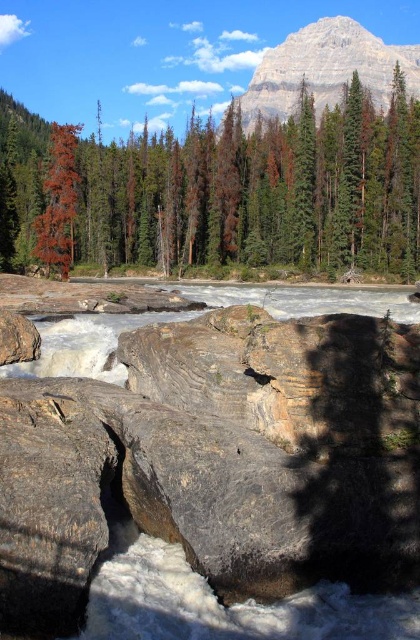
Is rocky beige mountain at upper center taller than reddish-brown bark tree at left?

Yes.

Locate an element on the screen. rocky beige mountain at upper center is located at coordinates (325, 68).

Is point (382, 48) positioned in front of point (62, 152)?

No, it is not.

Where is `rocky beige mountain at upper center`? The height and width of the screenshot is (640, 420). rocky beige mountain at upper center is located at coordinates (x=325, y=68).

Which is behind, point (335, 177) or point (296, 86)?

The point (296, 86) is behind.

Which is below, dead wood trees at upper left or rocky beige mountain at upper center?

Positioned lower is dead wood trees at upper left.

Which is in front, point (288, 164) or point (278, 52)?

Positioned in front is point (288, 164).

Locate an element on the screen. The image size is (420, 640). dead wood trees at upper left is located at coordinates (259, 192).

Measure the distance between dead wood trees at upper left and reddish-brown bark tree at left.

A distance of 120.56 feet exists between dead wood trees at upper left and reddish-brown bark tree at left.

Locate an element on the screen. The height and width of the screenshot is (640, 420). dead wood trees at upper left is located at coordinates (259, 192).